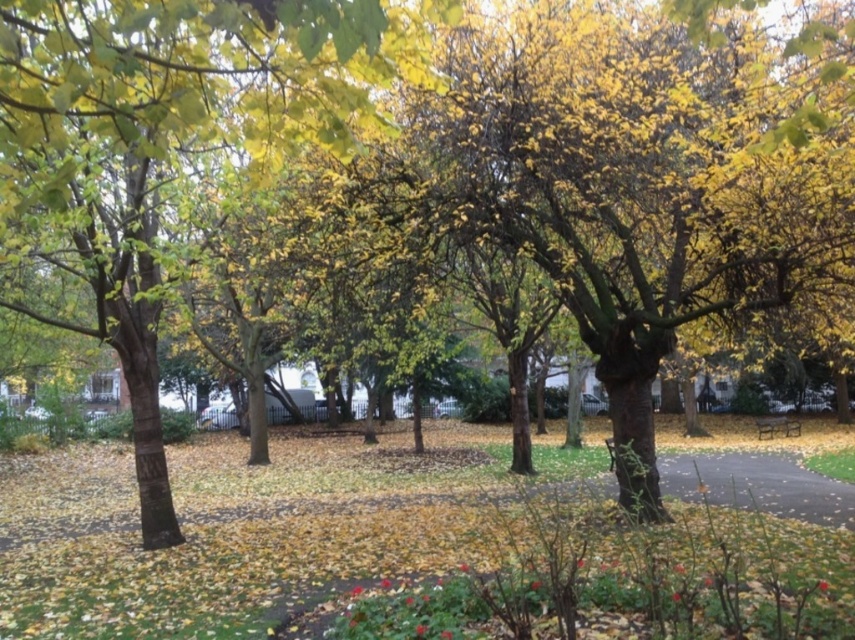
You are standing at the point marked as point (267, 83) in the park. You want to walk to the point marked as point (783, 420). Which direction should you move to get closer to your destination?

To move from point (267, 83) to point (783, 420), you should move towards the upper right direction since point (783, 420) is located in the upper right relative to point (267, 83).